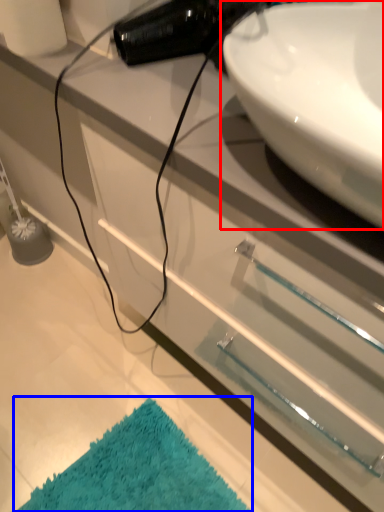
Question: Which point is further to the camera, sink (highlighted by a red box) or bath mat (highlighted by a blue box)?

Choices:
 (A) sink
 (B) bath mat

Answer: (B)